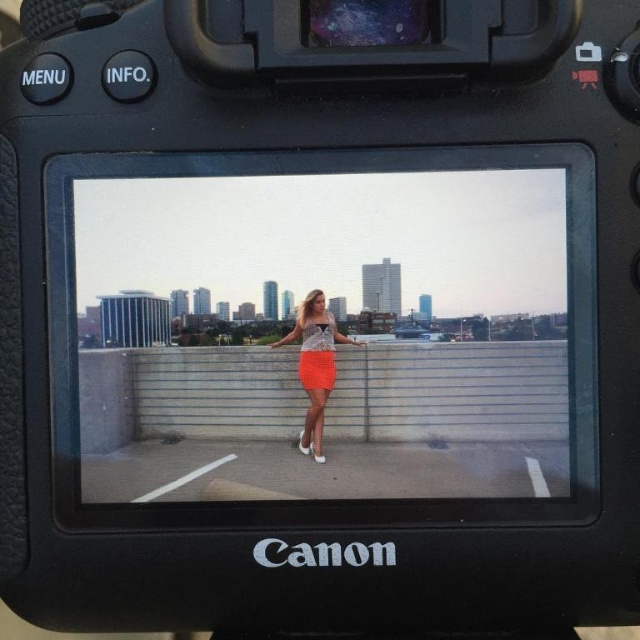
Question: Which point is farther to the camera?

Choices:
 (A) (298, 360)
 (B) (310, 428)

Answer: (A)

Question: Is orange crochet skirt at center above orange matte dress at center?

Choices:
 (A) yes
 (B) no

Answer: (B)

Question: Is the position of orange crochet skirt at center less distant than that of orange matte dress at center?

Choices:
 (A) no
 (B) yes

Answer: (B)

Question: Which point appears farthest from the camera in this image?

Choices:
 (A) (330, 323)
 (B) (307, 365)

Answer: (B)

Question: Which point is closer to the camera taking this photo?

Choices:
 (A) (317, 433)
 (B) (305, 339)

Answer: (A)

Question: Is orange crochet skirt at center to the right of orange matte dress at center from the viewer's perspective?

Choices:
 (A) no
 (B) yes

Answer: (B)